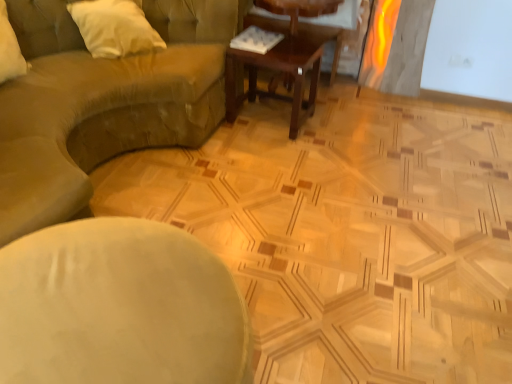
Question: Is smooth green cushion at center aimed at suede-like beige couch at upper left?

Choices:
 (A) yes
 (B) no

Answer: (B)

Question: Does smooth green cushion at center appear on the right side of suede-like beige couch at upper left?

Choices:
 (A) yes
 (B) no

Answer: (A)

Question: From a real-world perspective, is smooth green cushion at center physically above suede-like beige couch at upper left?

Choices:
 (A) no
 (B) yes

Answer: (A)

Question: Are smooth green cushion at center and suede-like beige couch at upper left beside each other?

Choices:
 (A) yes
 (B) no

Answer: (B)

Question: Considering the relative sizes of smooth green cushion at center and suede-like beige couch at upper left in the image provided, is smooth green cushion at center shorter than suede-like beige couch at upper left?

Choices:
 (A) no
 (B) yes

Answer: (B)

Question: Is smooth green cushion at center closer to the viewer compared to suede-like beige couch at upper left?

Choices:
 (A) no
 (B) yes

Answer: (B)

Question: Is wooden coffee table at center taller than smooth green cushion at center?

Choices:
 (A) no
 (B) yes

Answer: (B)

Question: Could you tell me if wooden coffee table at center is facing smooth green cushion at center?

Choices:
 (A) yes
 (B) no

Answer: (A)

Question: Is the position of wooden coffee table at center more distant than that of smooth green cushion at center?

Choices:
 (A) no
 (B) yes

Answer: (B)

Question: Does wooden coffee table at center have a smaller size compared to smooth green cushion at center?

Choices:
 (A) no
 (B) yes

Answer: (B)

Question: Considering the relative positions of wooden coffee table at center and smooth green cushion at center in the image provided, is wooden coffee table at center to the left of smooth green cushion at center from the viewer's perspective?

Choices:
 (A) yes
 (B) no

Answer: (B)

Question: Is wooden coffee table at center thinner than smooth green cushion at center?

Choices:
 (A) yes
 (B) no

Answer: (A)

Question: Could you tell me if white soft pillow at upper left is turned towards wooden coffee table at center?

Choices:
 (A) no
 (B) yes

Answer: (A)